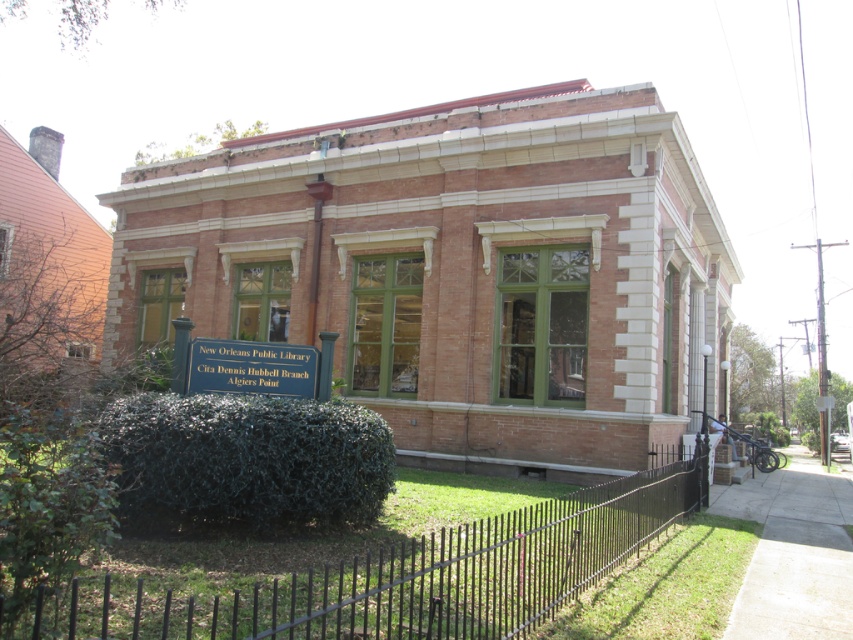
Based on the photo, does dark green bush at lower left appear under metallic silver sign at center?

Correct, dark green bush at lower left is located below metallic silver sign at center.

Does dark green bush at lower left have a greater width compared to metallic silver sign at center?

Yes, dark green bush at lower left is wider than metallic silver sign at center.

You are a GUI agent. You are given a task and a screenshot of the screen. Output one action in this format:
    pyautogui.click(x=<x>, y=<y>)
    Task: Click on the dark green bush at lower left
    The image size is (853, 640).
    Given the screenshot: What is the action you would take?
    pyautogui.click(x=247, y=458)